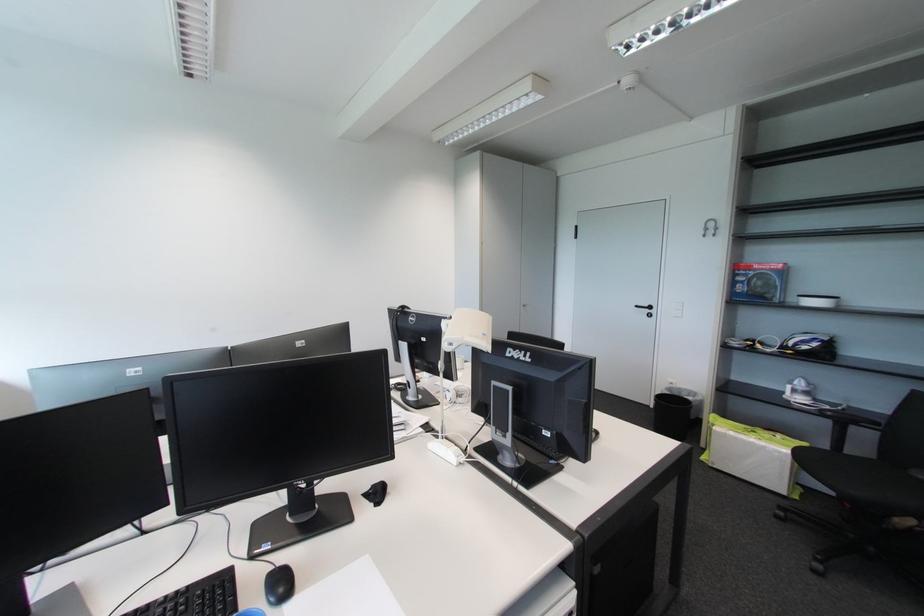
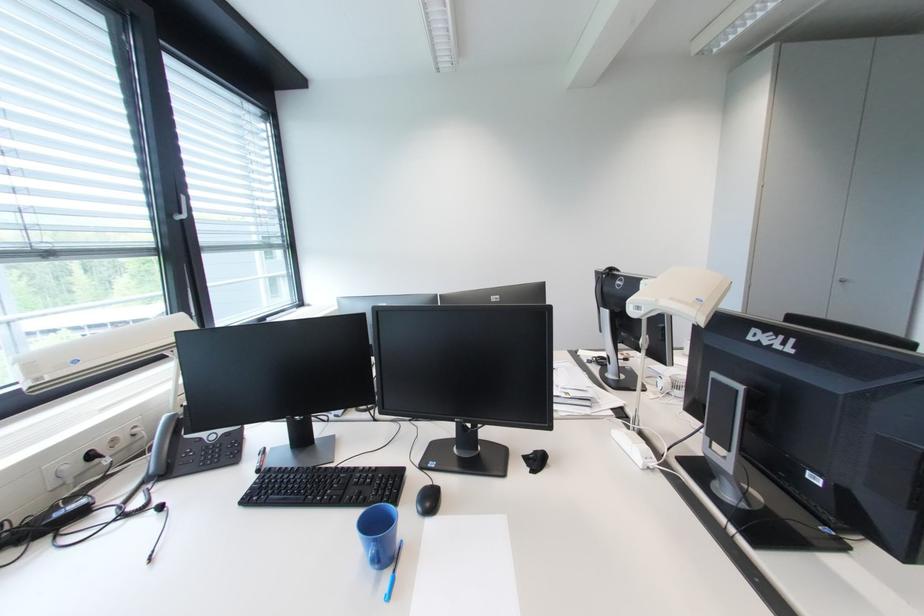
Where in the second image is the point corresponding to [529,309] from the first image?

(844, 285)